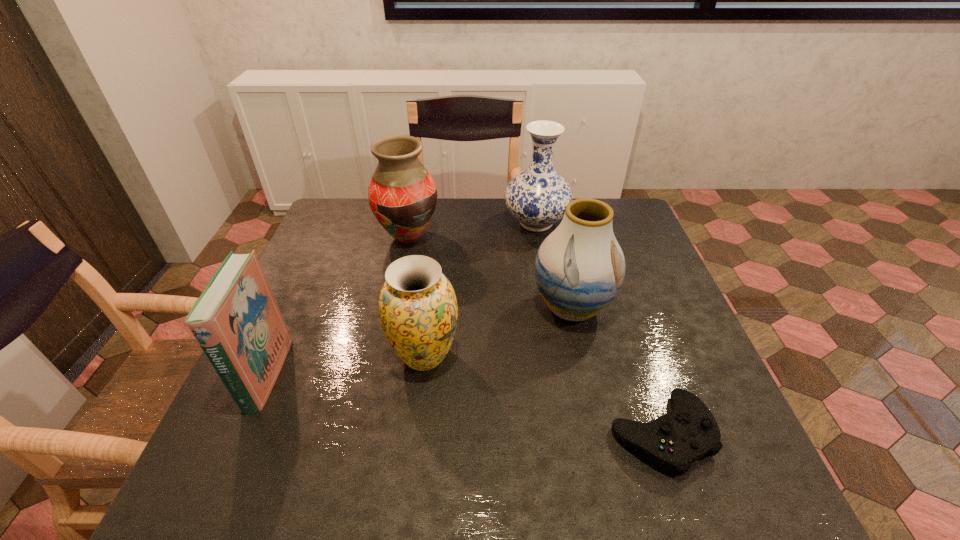
This screenshot has width=960, height=540. What are the coordinates of `hardback book` in the screenshot? It's located at (236, 321).

In order to click on the shortest vase in this screenshot , I will do `click(418, 310)`.

Identify the location of control. The image size is (960, 540). (x=673, y=441).

Locate an element on the screen. The image size is (960, 540). blank space located on the cover of the leftmost object is located at coordinates (366, 375).

At what (x,y) coordinates should I click in order to perform the action: click on vacant space situated on the left of the shortest vase. Please return your answer as a coordinate pair (x, y). Image resolution: width=960 pixels, height=540 pixels. Looking at the image, I should click on 319,356.

This screenshot has width=960, height=540. I want to click on vacant space located 0.300m on the left of the shortest object, so click(458, 434).

This screenshot has width=960, height=540. Identify the location of object located at the near edge. (673, 441).

Find the location of a particular element. This screenshot has width=960, height=540. object located at the left edge is located at coordinates (236, 321).

At what (x,y) coordinates should I click in order to perform the action: click on object that is positioned at the right edge. Please return your answer as a coordinate pair (x, y). This screenshot has height=540, width=960. Looking at the image, I should click on (673, 441).

The width and height of the screenshot is (960, 540). Identify the location of object at the near right corner. coord(673,441).